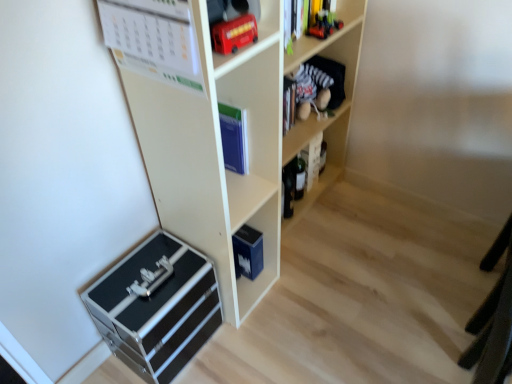
Question: In the image, is matte black book at center right, acting as the 1th book starting from the right, positioned in front of or behind metallic red toy car at upper right, the 2th toy positioned from the front?

Choices:
 (A) front
 (B) behind

Answer: (B)

Question: From a real-world perspective, is matte black book at center right, acting as the second book starting from the front, physically located above or below metallic red toy car at upper right, the first toy positioned from the right?

Choices:
 (A) above
 (B) below

Answer: (B)

Question: Estimate the real-world distances between objects in this image. Which object is closer to the velvet plush toy at upper right, the second shelf positioned from the top?

Choices:
 (A) black metallic toolbox at lower left, which appears as the 4th shelf when viewed from the top
 (B) matte black book at center right, acting as the 1th book starting from the right
 (C) matte black toolbox at lower left, which is the 3th shelf in top-to-bottom order
 (D) metallic red bus at upper center, the second toy from the right
 (E) metallic red toy bus at upper right, which ranks as the fourth shelf in bottom-to-top order

Answer: (E)

Question: Considering the real-world distances, which object is closest to the black metallic toolbox at lower left, the first shelf when ordered from bottom to top?

Choices:
 (A) matte black toolbox at lower left, placed as the second shelf when sorted from bottom to top
 (B) metallic red toy bus at upper right, which ranks as the fourth shelf in bottom-to-top order
 (C) blue matte book at center
 (D) velvet plush toy at upper right, the second shelf positioned from the top
 (E) metallic red bus at upper center, the first toy viewed from the left

Answer: (A)